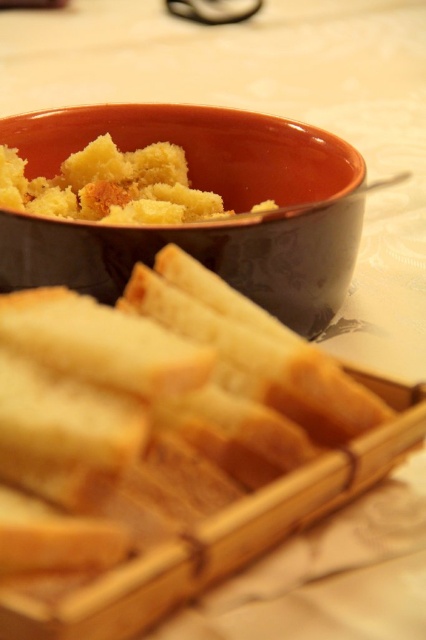
This screenshot has width=426, height=640. What do you see at coordinates (201, 224) in the screenshot? I see `matte ceramic bowl at upper center` at bounding box center [201, 224].

In order to click on matte ceramic bowl at upper center in this screenshot , I will do `click(201, 224)`.

Who is more distant from viewer, (354,209) or (31,180)?

The point (31,180) is behind.

Locate an element on the screen. This screenshot has width=426, height=640. matte ceramic bowl at upper center is located at coordinates (201, 224).